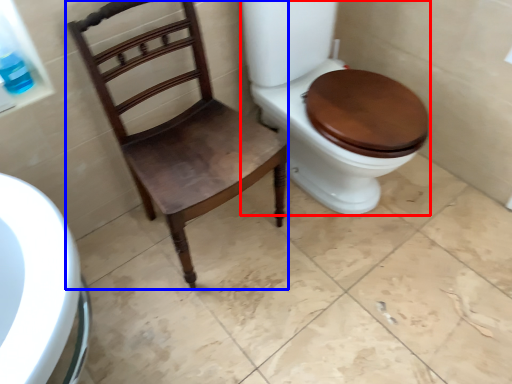
Question: Among these objects, which one is farthest to the camera, toilet (highlighted by a red box) or chair (highlighted by a blue box)?

Choices:
 (A) toilet
 (B) chair

Answer: (A)